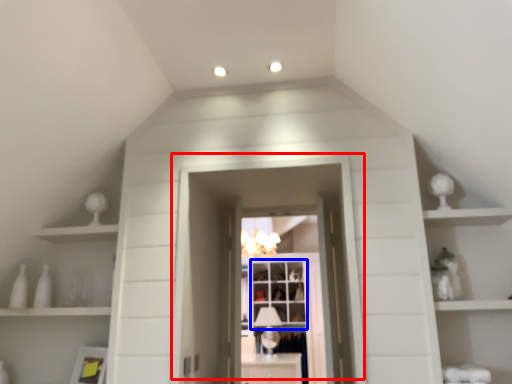
Question: Which of the following is the farthest to the observer, door (highlighted by a red box) or window (highlighted by a blue box)?

Choices:
 (A) door
 (B) window

Answer: (B)